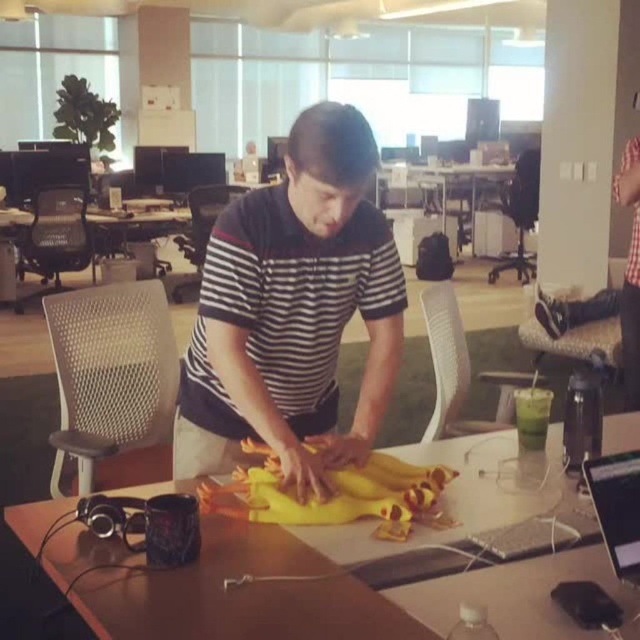
The image size is (640, 640). What are the coordinates of `yellow rubber duck at center` in the screenshot? It's located at (332, 492).

Locate an element on the screen. yellow rubber duck at center is located at coordinates (332, 492).

Which is behind, point (124, 611) or point (285, 493)?

The point (285, 493) is more distant.

Between yellow fabric at center and yellow rubber duck at center, which one is positioned lower?

Positioned lower is yellow fabric at center.

This screenshot has width=640, height=640. Find the location of `yellow fabric at center`. yellow fabric at center is located at coordinates (252, 593).

Where is `yellow fabric at center`? yellow fabric at center is located at coordinates (252, 593).

Which is more to the right, striped cotton shirt at center or yellow fabric at center?

yellow fabric at center is more to the right.

Is striped cotton shirt at center smaller than yellow fabric at center?

Indeed, striped cotton shirt at center has a smaller size compared to yellow fabric at center.

Which is behind, point (289, 355) or point (320, 595)?

The point (289, 355) is behind.

Where is `striped cotton shirt at center`? This screenshot has height=640, width=640. striped cotton shirt at center is located at coordinates (292, 307).